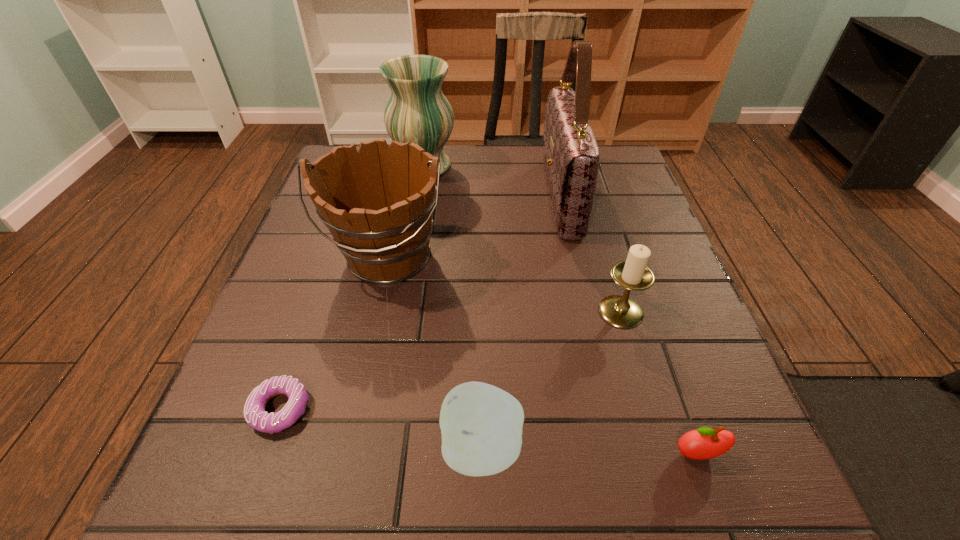
Locate an element on the screen. the tallest object is located at coordinates (571, 156).

You are a GUI agent. You are given a task and a screenshot of the screen. Output one action in this format:
    pyautogui.click(x=<x>, y=<y>)
    Task: Click on the vase
    This screenshot has width=960, height=540.
    Given the screenshot: What is the action you would take?
    coord(417,112)

Find the location of a particular element. wine bucket is located at coordinates (377, 203).

Locate an element on the screen. The image size is (960, 540). candle holder is located at coordinates (633, 274).

This screenshot has height=540, width=960. I want to click on the taller apple, so click(x=481, y=425).

Locate an element on the screen. the left apple is located at coordinates (481, 425).

Locate an element on the screen. The width and height of the screenshot is (960, 540). the right apple is located at coordinates (704, 443).

Find the location of a particular element. the shorter apple is located at coordinates (704, 443).

Where is `doughnut`? This screenshot has height=540, width=960. doughnut is located at coordinates (255, 415).

You are a GUI agent. You are given a task and a screenshot of the screen. Output one action in this format:
    pyautogui.click(x=<x>, y=<y>)
    Task: Click on the free space located 0.160m on the front of the handbag with the clasp
    The image size is (960, 540).
    Given the screenshot: What is the action you would take?
    pyautogui.click(x=477, y=197)